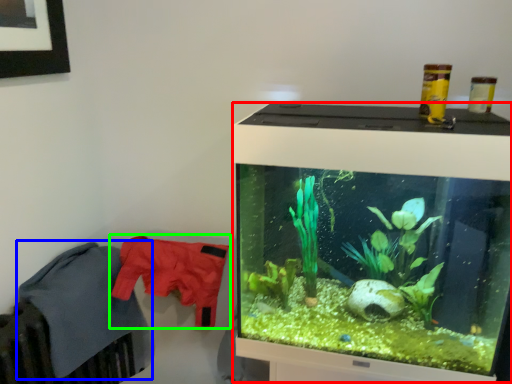
Question: Which object is positioned farthest from computer monitor (highlighted by a red box)? Select from clothing (highlighted by a blue box) and clothing (highlighted by a green box).

Choices:
 (A) clothing
 (B) clothing

Answer: (A)